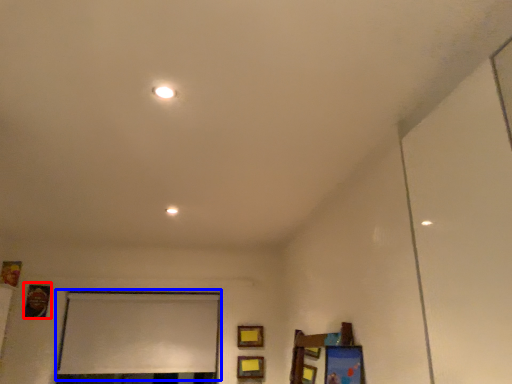
Question: Which point is closer to the camera, picture frame (highlighted by a red box) or window screen (highlighted by a blue box)?

Choices:
 (A) picture frame
 (B) window screen

Answer: (A)